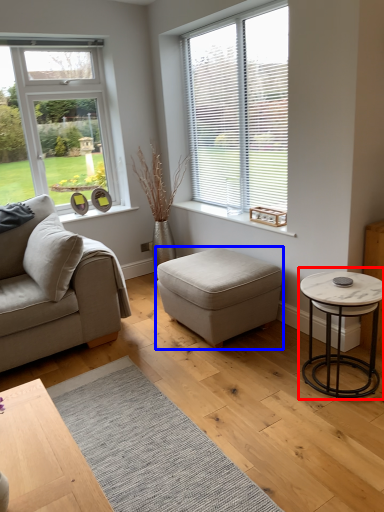
Question: Among these objects, which one is nearest to the camera, coffee table (highlighted by a red box) or stool (highlighted by a blue box)?

Choices:
 (A) coffee table
 (B) stool

Answer: (A)